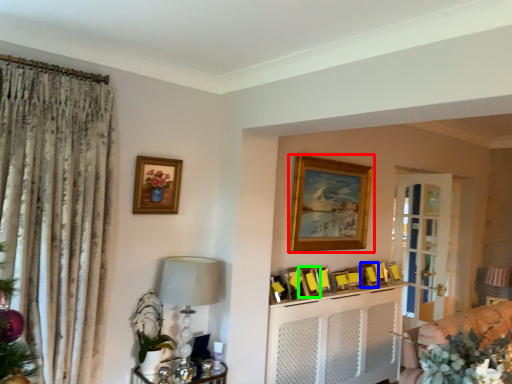
Question: Based on their relative distances, which object is farther from picture frame (highlighted by a red box)? Choose from picture frame (highlighted by a blue box) and picture frame (highlighted by a green box).

Choices:
 (A) picture frame
 (B) picture frame

Answer: (A)